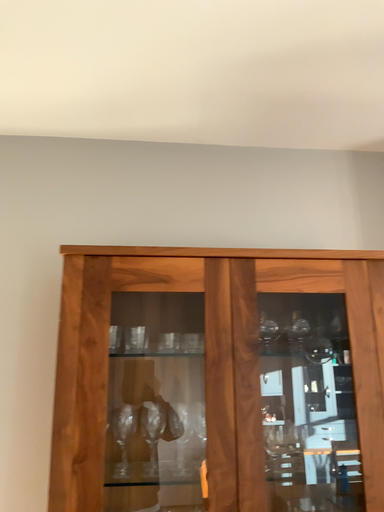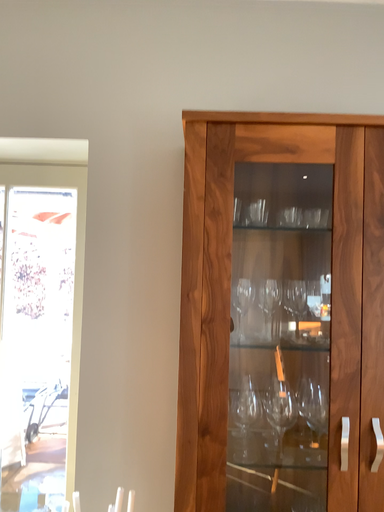
Question: How did the camera likely rotate when shooting the video?

Choices:
 (A) rotated left
 (B) rotated right

Answer: (A)